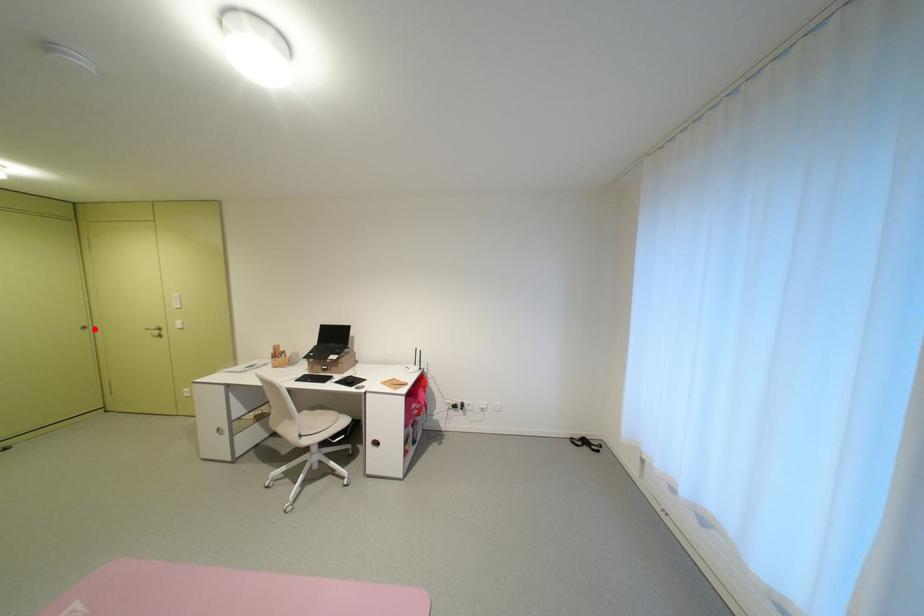
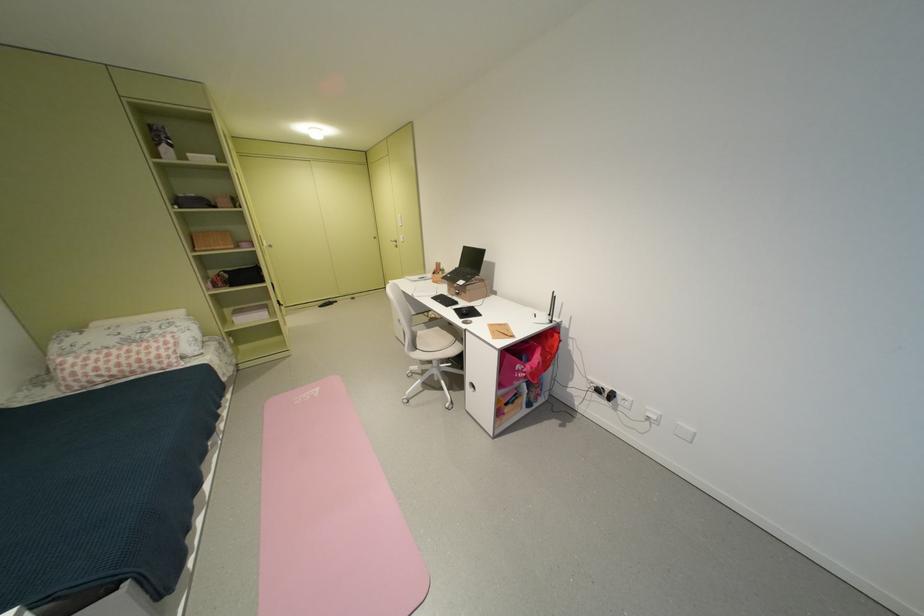
Question: I am providing you with two images of the same scene from different viewpoints. Given a red point in image1, look at the same physical point in image2. Is it:

Choices:
 (A) Closer to the viewpoint
 (B) Farther from the viewpoint

Answer: (A)